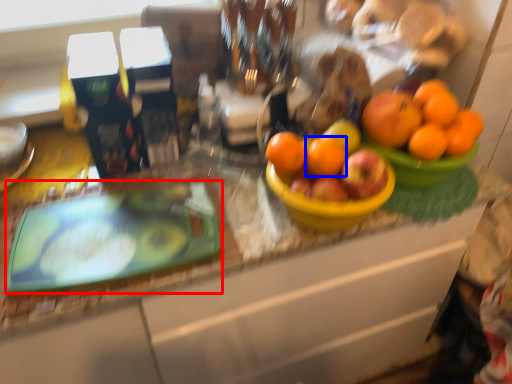
Question: Which of the following is the farthest to the observer, glass plate (highlighted by a red box) or orange (highlighted by a blue box)?

Choices:
 (A) glass plate
 (B) orange

Answer: (B)